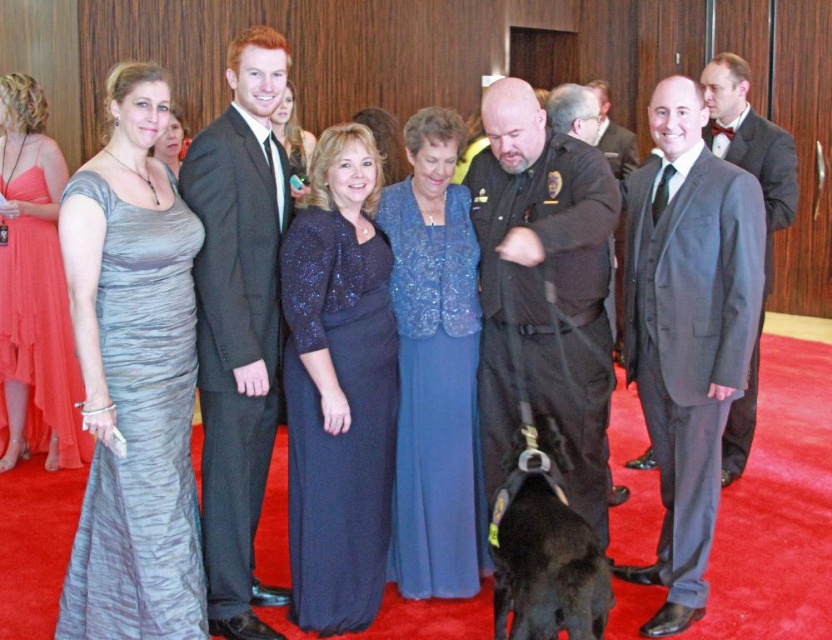
Question: Does matte gray suit at center appear over dark gray uniform at center?

Choices:
 (A) yes
 (B) no

Answer: (B)

Question: Based on their relative distances, which object is farther from the black leather dog at center?

Choices:
 (A) shiny coral dress at left
 (B) shiny silver dress at center
 (C) matte black suit at right
 (D) matte gray suit at center

Answer: (B)

Question: Does matte gray suit at center come in front of matte black suit at right?

Choices:
 (A) yes
 (B) no

Answer: (A)

Question: Can you confirm if shiny black suit at center is thinner than dark gray uniform at center?

Choices:
 (A) yes
 (B) no

Answer: (B)

Question: Which object is closer to the camera taking this photo?

Choices:
 (A) blue sequined dress at center
 (B) sparkly dark blue dress at center
 (C) shimmering satin gown at left
 (D) shiny coral dress at left

Answer: (C)

Question: Which of the following is the farthest from the observer?

Choices:
 (A) blue sequined dress at center
 (B) shiny black suit at center

Answer: (A)